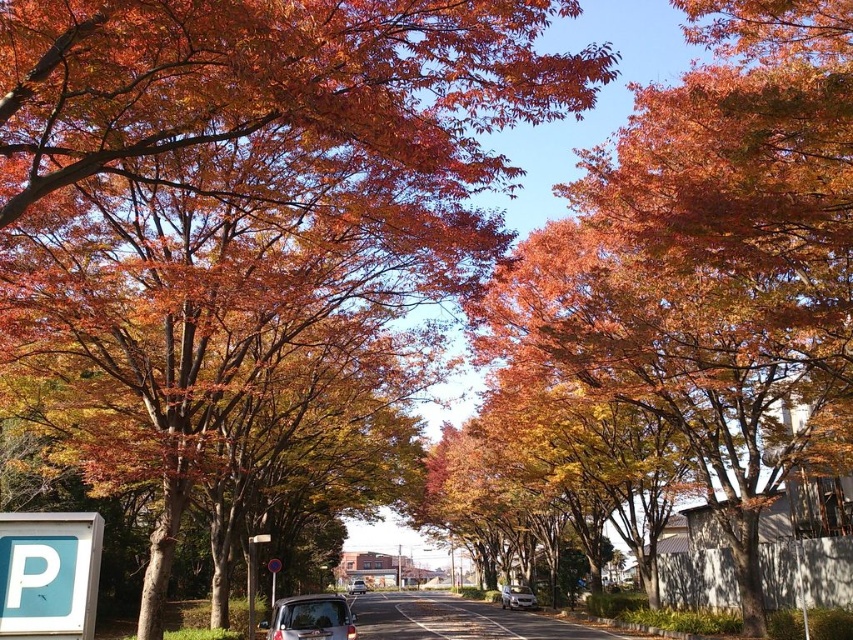
Question: Which point appears farthest from the camera in this image?

Choices:
 (A) (271, 586)
 (B) (91, 518)

Answer: (A)

Question: Does metallic silver minivan at center have a lesser width compared to metallic reflective sign at center?

Choices:
 (A) no
 (B) yes

Answer: (A)

Question: Does blue plastic parking sign at lower left have a larger size compared to metallic silver car at center?

Choices:
 (A) yes
 (B) no

Answer: (B)

Question: Estimate the real-world distances between objects in this image. Which object is closer to the metallic silver sedan at center?

Choices:
 (A) metallic silver street sign at center
 (B) metallic silver minivan at center
 (C) metallic reflective sign at center

Answer: (C)

Question: Which object appears farthest from the camera in this image?

Choices:
 (A) metallic reflective sign at center
 (B) metallic silver minivan at center
 (C) metallic silver sedan at center
 (D) blue plastic parking sign at lower left

Answer: (C)

Question: Does metallic reflective sign at center have a greater width compared to metallic silver sedan at center?

Choices:
 (A) no
 (B) yes

Answer: (B)